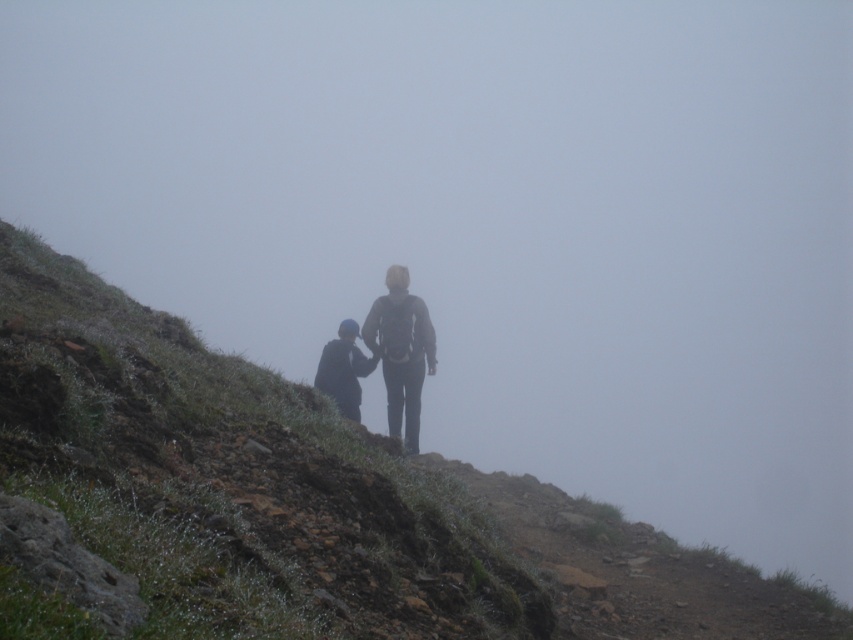
Question: Is dull brown dirt at center thinner than dark blue fabric jacket at center?

Choices:
 (A) yes
 (B) no

Answer: (B)

Question: Considering the real-world distances, which object is closest to the dark blue fabric jacket at center?

Choices:
 (A) dull brown dirt at center
 (B) dark gray fabric jacket at center

Answer: (B)

Question: In this image, where is dark gray fabric jacket at center located relative to dark blue fabric jacket at center?

Choices:
 (A) above
 (B) below

Answer: (A)

Question: Which object is the farthest from the dark gray fabric jacket at center?

Choices:
 (A) dull brown dirt at center
 (B) dark blue fabric jacket at center

Answer: (A)

Question: Which point is farther to the camera?

Choices:
 (A) (78, 484)
 (B) (341, 404)

Answer: (B)

Question: Does dull brown dirt at center appear on the left side of dark blue fabric jacket at center?

Choices:
 (A) yes
 (B) no

Answer: (A)